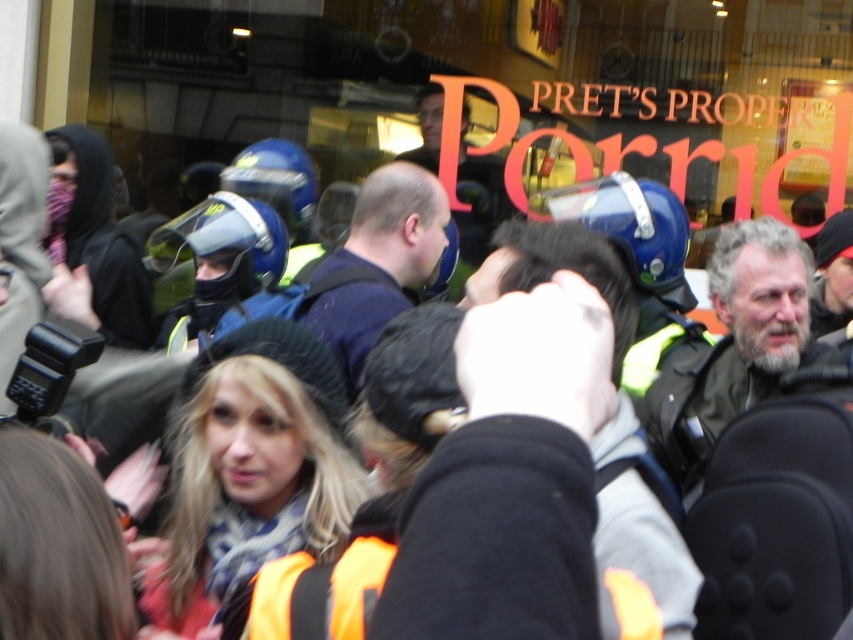
Does gray beard at center appear on the left side of dark blue shirt at center?

In fact, gray beard at center is to the right of dark blue shirt at center.

Which is behind, point (769, 371) or point (425, 272)?

The point (425, 272) is more distant.

Is point (699, 387) positioned behind point (357, 371)?

No, (699, 387) is in front of (357, 371).

At what (x,y) coordinates should I click in order to perform the action: click on gray beard at center. Please return your answer as a coordinate pair (x, y). This screenshot has width=853, height=640. Looking at the image, I should click on (735, 346).